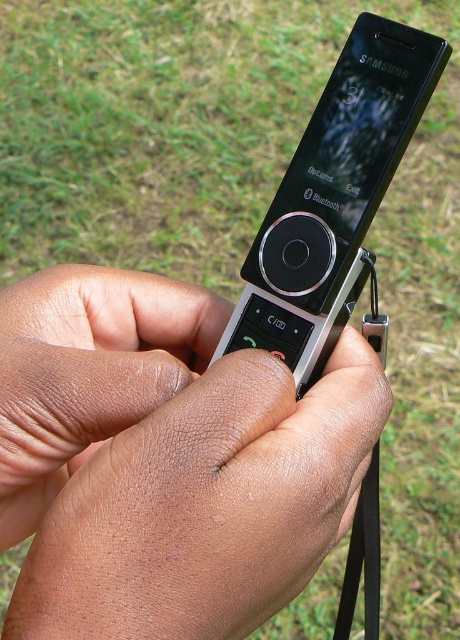
Between point (305, 337) and point (345, 598), which one is positioned behind?

The point (345, 598) is more distant.

Can you confirm if black glossy phone at center is thinner than black rubber strap at lower right?

Incorrect, black glossy phone at center's width is not less than black rubber strap at lower right's.

Does point (311, 253) lie behind point (373, 568)?

That is False.

The image size is (460, 640). What are the coordinates of `black glossy phone at center` in the screenshot? It's located at tap(333, 196).

Between smooth skin hands at center and black rubber strap at lower right, which one appears on the right side from the viewer's perspective?

From the viewer's perspective, black rubber strap at lower right appears more on the right side.

Does smooth skin hands at center have a smaller size compared to black rubber strap at lower right?

No.

Where is `smooth skin hands at center`? Image resolution: width=460 pixels, height=640 pixels. smooth skin hands at center is located at coordinates (x=166, y=460).

Who is positioned more to the left, smooth skin hands at center or black glossy phone at center?

From the viewer's perspective, smooth skin hands at center appears more on the left side.

This screenshot has height=640, width=460. What do you see at coordinates (166, 460) in the screenshot? I see `smooth skin hands at center` at bounding box center [166, 460].

Identify the location of smooth skin hands at center. The height and width of the screenshot is (640, 460). (166, 460).